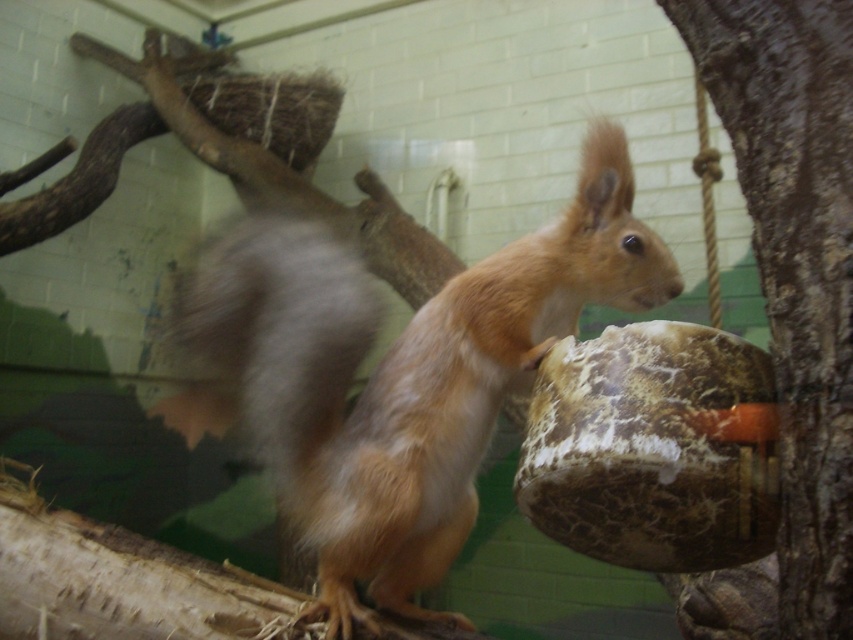
Is fluffy brown squirrel at center taller than brown rough bark at right?

Yes, fluffy brown squirrel at center is taller than brown rough bark at right.

Who is more distant from viewer, (498, 317) or (805, 438)?

Point (498, 317)

Image resolution: width=853 pixels, height=640 pixels. What do you see at coordinates (401, 372) in the screenshot?
I see `fluffy brown squirrel at center` at bounding box center [401, 372].

Locate an element on the screen. The height and width of the screenshot is (640, 853). fluffy brown squirrel at center is located at coordinates (401, 372).